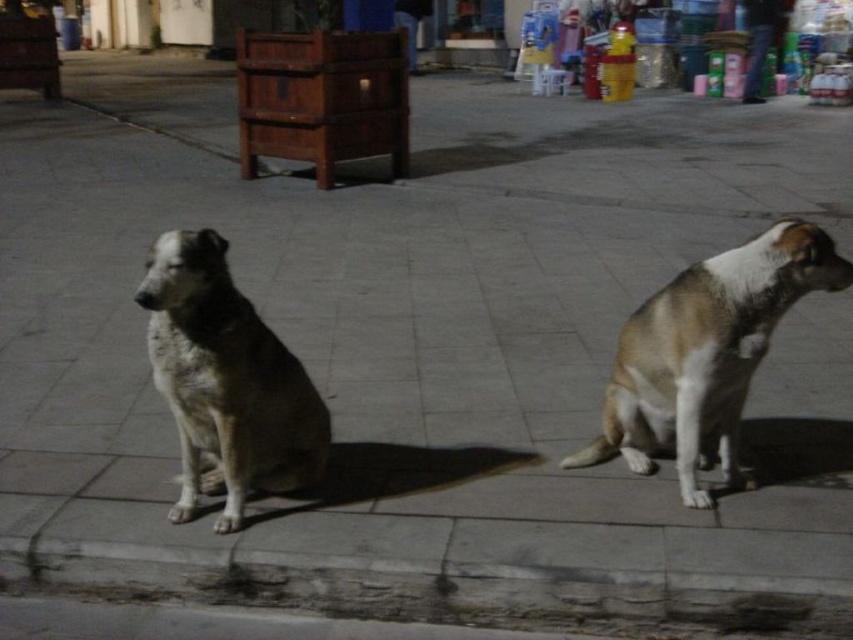
Question: Which point appears closest to the camera in this image?

Choices:
 (A) (207, 289)
 (B) (166, 557)

Answer: (A)

Question: From the image, what is the correct spatial relationship of concrete curb at lower center in relation to brown fur dog at right?

Choices:
 (A) left
 (B) right

Answer: (A)

Question: Does brown fur dog at right appear on the left side of fuzzy fur dog at left?

Choices:
 (A) no
 (B) yes

Answer: (A)

Question: Which of the following is the closest to the observer?

Choices:
 (A) click(x=154, y=557)
 (B) click(x=640, y=310)

Answer: (A)

Question: Does brown fur dog at right appear on the left side of fuzzy fur dog at left?

Choices:
 (A) yes
 (B) no

Answer: (B)

Question: Which point is closer to the camera?

Choices:
 (A) concrete curb at lower center
 (B) fuzzy fur dog at left

Answer: (A)